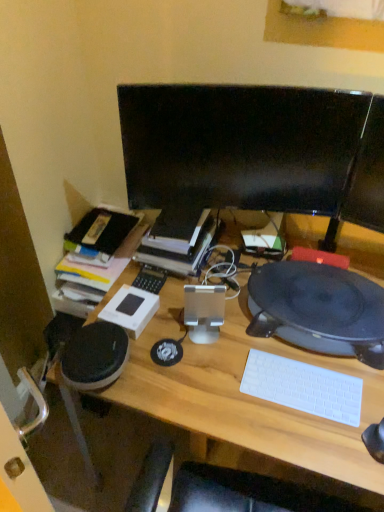
Question: Does hardcover book at center have a lesser width compared to wooden desk at center?

Choices:
 (A) no
 (B) yes

Answer: (B)

Question: Is wooden desk at center a part of hardcover book at center?

Choices:
 (A) no
 (B) yes

Answer: (A)

Question: Does hardcover book at center lie in front of wooden desk at center?

Choices:
 (A) yes
 (B) no

Answer: (B)

Question: Can you confirm if hardcover book at center is wider than wooden desk at center?

Choices:
 (A) no
 (B) yes

Answer: (A)

Question: Is hardcover book at center not inside wooden desk at center?

Choices:
 (A) no
 (B) yes

Answer: (B)

Question: Is hardcover book at center bigger than wooden desk at center?

Choices:
 (A) no
 (B) yes

Answer: (A)

Question: Considering the relative positions of wooden desk at center and white plastic keyboard at lower right in the image provided, is wooden desk at center to the left of white plastic keyboard at lower right from the viewer's perspective?

Choices:
 (A) no
 (B) yes

Answer: (B)

Question: Is wooden desk at center placed right next to white plastic keyboard at lower right?

Choices:
 (A) no
 (B) yes

Answer: (A)

Question: Can we say wooden desk at center lies outside white plastic keyboard at lower right?

Choices:
 (A) no
 (B) yes

Answer: (B)

Question: Considering the relative sizes of wooden desk at center and white plastic keyboard at lower right in the image provided, is wooden desk at center taller than white plastic keyboard at lower right?

Choices:
 (A) no
 (B) yes

Answer: (B)

Question: Does wooden desk at center have a lesser height compared to white plastic keyboard at lower right?

Choices:
 (A) yes
 (B) no

Answer: (B)

Question: Is wooden desk at center positioned with its back to white plastic keyboard at lower right?

Choices:
 (A) no
 (B) yes

Answer: (B)

Question: Considering the relative sizes of black glossy monitor at center and wooden desk at center in the image provided, is black glossy monitor at center wider than wooden desk at center?

Choices:
 (A) yes
 (B) no

Answer: (B)